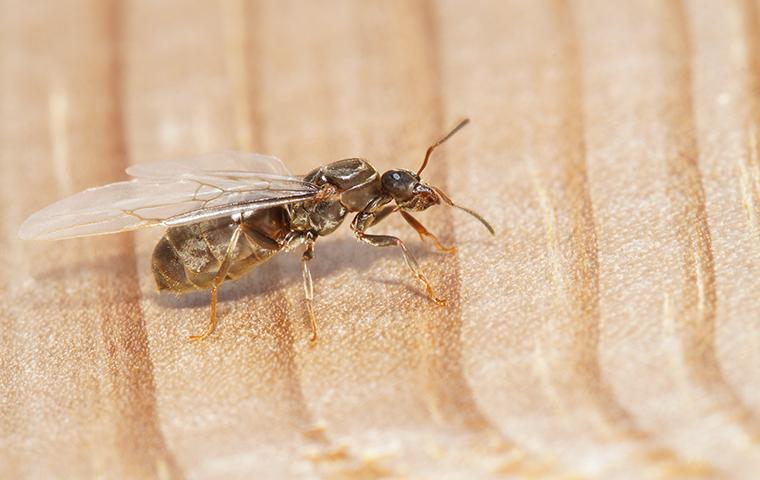
Locate an element on the screen. The width and height of the screenshot is (760, 480). gold colored leg is located at coordinates (210, 295).